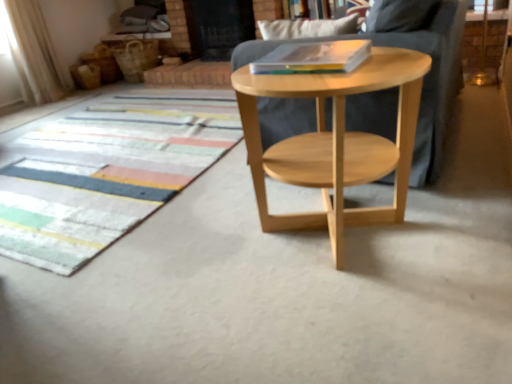
Where is `vacant location below natural wood side table at center (from a real-world perspective)`? This screenshot has height=384, width=512. vacant location below natural wood side table at center (from a real-world perspective) is located at coordinates (322, 240).